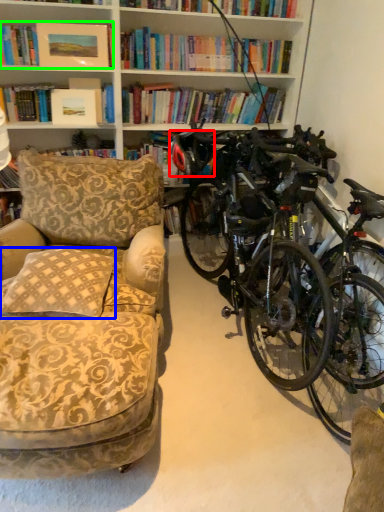
Question: Considering the real-world distances, which object is closest to helmet (highlighted by a red box)? pillow (highlighted by a blue box) or book (highlighted by a green box).

Choices:
 (A) pillow
 (B) book

Answer: (B)